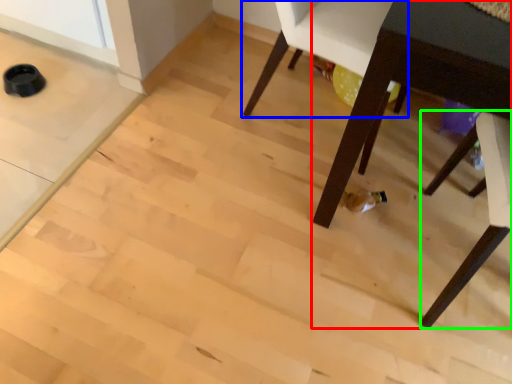
Question: Which object is positioned closest to table (highlighted by a red box)? Select from chair (highlighted by a blue box) and chair (highlighted by a green box).

Choices:
 (A) chair
 (B) chair

Answer: (B)